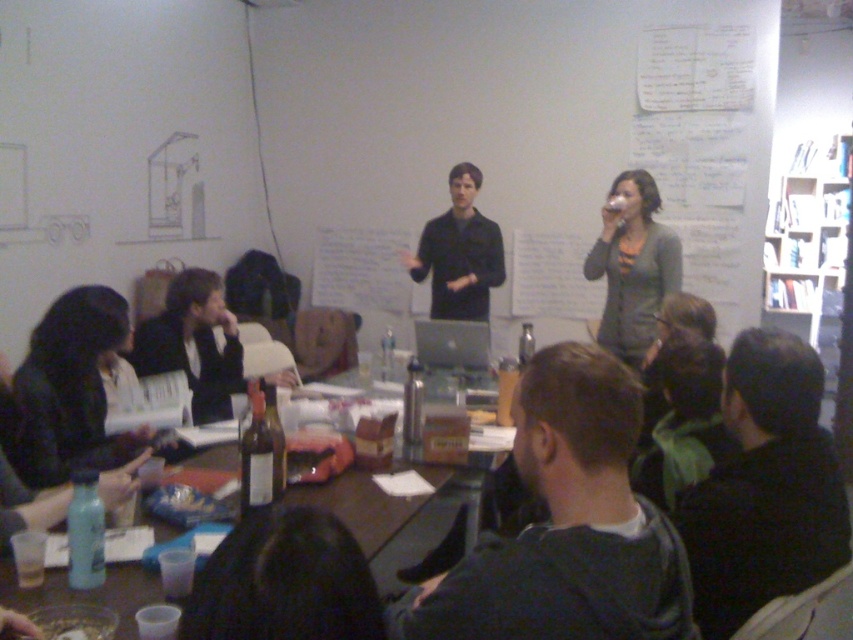
Question: Is dark brown hair at lower left positioned in front of matte black shirt at center?

Choices:
 (A) yes
 (B) no

Answer: (A)

Question: Which point is closer to the camera taking this photo?

Choices:
 (A) (231, 387)
 (B) (604, 230)
 (C) (383, 563)
 (D) (59, 416)

Answer: (D)

Question: Is brown wooden table at lower center above matte black jacket at lower left?

Choices:
 (A) no
 (B) yes

Answer: (A)

Question: Does dark brown hair at lower left have a greater width compared to matte gray cardigan at upper right?

Choices:
 (A) yes
 (B) no

Answer: (B)

Question: Considering the real-world distances, which object is farthest from the matte black shirt at center?

Choices:
 (A) dark brown hair at lower left
 (B) brown wooden table at lower center
 (C) dark gray sweater at center

Answer: (C)

Question: Which object appears farthest from the camera in this image?

Choices:
 (A) dark wool sweater at lower right
 (B) matte black jacket at lower left
 (C) matte black shirt at center

Answer: (C)